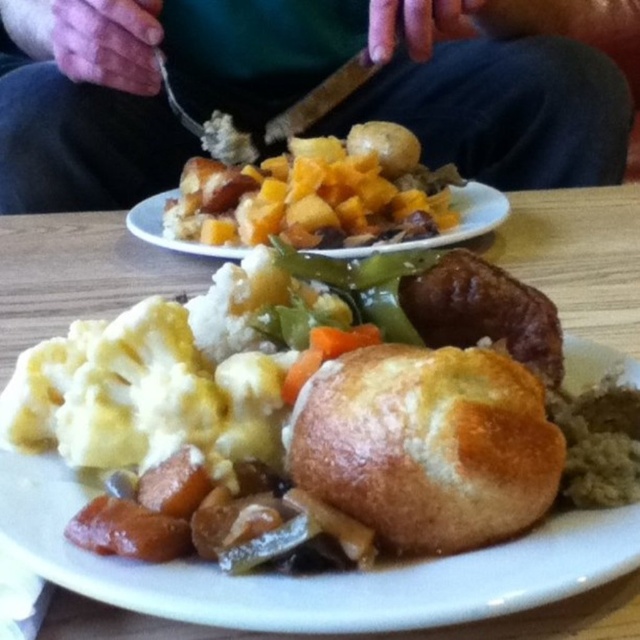
Question: Can you confirm if golden brown bread roll at center is bigger than golden brown crusty bread at center?

Choices:
 (A) yes
 (B) no

Answer: (A)

Question: Which object is farther from the camera taking this photo?

Choices:
 (A) golden brown bread roll at center
 (B) green fabric shirt at upper center
 (C) golden brown crusty bread at center

Answer: (B)

Question: Is golden brown crusty bread at center to the left of golden brown croutons at center from the viewer's perspective?

Choices:
 (A) yes
 (B) no

Answer: (B)

Question: Which object appears closest to the camera in this image?

Choices:
 (A) golden brown crusty bread at center
 (B) golden brown croutons at center
 (C) golden brown crumbly pastry at center

Answer: (A)

Question: Which object appears farthest from the camera in this image?

Choices:
 (A) brown crispy sausage at center-right
 (B) green fabric shirt at upper center
 (C) golden brown bread roll at center

Answer: (B)

Question: Is golden brown bread roll at center to the left of brown crispy sausage at center-right from the viewer's perspective?

Choices:
 (A) no
 (B) yes

Answer: (B)